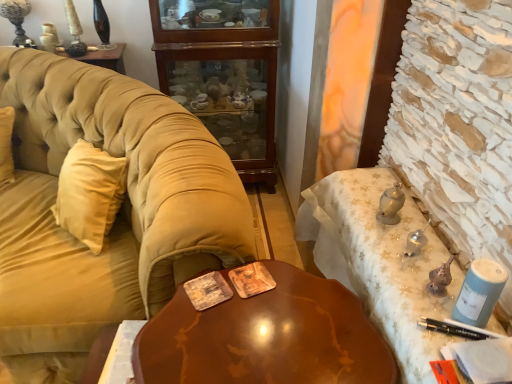
Question: Is metallic silver desk at right bigger than velvet beige couch at left?

Choices:
 (A) yes
 (B) no

Answer: (B)

Question: From the image's perspective, is metallic silver desk at right beneath velvet beige couch at left?

Choices:
 (A) yes
 (B) no

Answer: (A)

Question: Can you confirm if metallic silver desk at right is thinner than velvet beige couch at left?

Choices:
 (A) yes
 (B) no

Answer: (A)

Question: Does metallic silver desk at right come in front of velvet beige couch at left?

Choices:
 (A) yes
 (B) no

Answer: (A)

Question: Is metallic silver desk at right positioned with its back to velvet beige couch at left?

Choices:
 (A) yes
 (B) no

Answer: (B)

Question: Is metallic silver desk at right positioned far away from velvet beige couch at left?

Choices:
 (A) no
 (B) yes

Answer: (A)

Question: Are mahogany wood cabinet at center and glossy wood table at center located far from each other?

Choices:
 (A) yes
 (B) no

Answer: (A)

Question: Is mahogany wood cabinet at center aimed at glossy wood table at center?

Choices:
 (A) no
 (B) yes

Answer: (B)

Question: Can you confirm if mahogany wood cabinet at center is thinner than glossy wood table at center?

Choices:
 (A) no
 (B) yes

Answer: (B)

Question: Can you confirm if mahogany wood cabinet at center is shorter than glossy wood table at center?

Choices:
 (A) yes
 (B) no

Answer: (B)

Question: From a real-world perspective, is mahogany wood cabinet at center beneath glossy wood table at center?

Choices:
 (A) no
 (B) yes

Answer: (A)

Question: Is mahogany wood cabinet at center completely or partially outside of glossy wood table at center?

Choices:
 (A) no
 (B) yes

Answer: (B)

Question: Is glossy wood table at center outside of velvet beige couch at left?

Choices:
 (A) no
 (B) yes

Answer: (B)